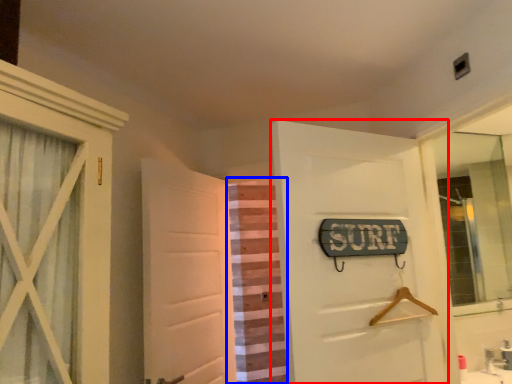
Question: Which object is closer to the camera taking this photo, door (highlighted by a red box) or curtain (highlighted by a blue box)?

Choices:
 (A) door
 (B) curtain

Answer: (A)